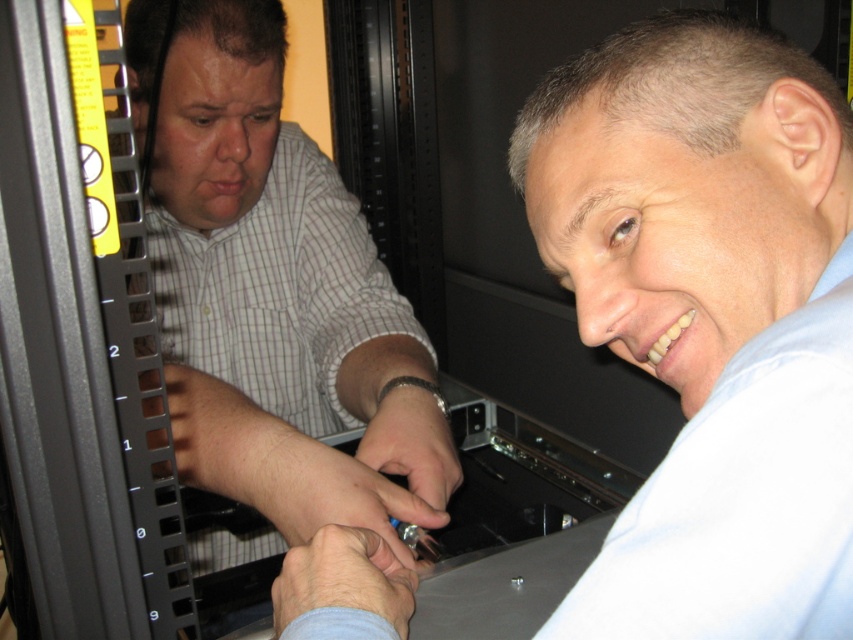
You are a technician needing to access the server rack. You see the light blue shirt at center and the white checkered shirt at left. Which shirt is positioned closer to the right side of the server rack?

The light blue shirt at center is positioned to the right of the white checkered shirt at left, so it is closer to the right side of the server rack.

In the scene shown: You are a technician who needs to pass a tool to your colleague. You are wearing the light blue shirt at center and your colleague is wearing the white checkered shirt at left. Can you reach them without moving your position if your arms can extend 14 inches?

The light blue shirt at center and white checkered shirt at left are 13.24 inches apart. Since your arms can extend 14 inches, which is longer than the distance between you, you can reach them without moving.

You are a technician working on the server rack. You need to determine which point is closer to your current position. The points are point 1 at coordinates point (x=680, y=372) and point 2 at coordinates point (x=281, y=509). Which point is closer to you?

Point 1 at coordinates point (x=680, y=372) is closer to the camera than point 2 at coordinates point (x=281, y=509).